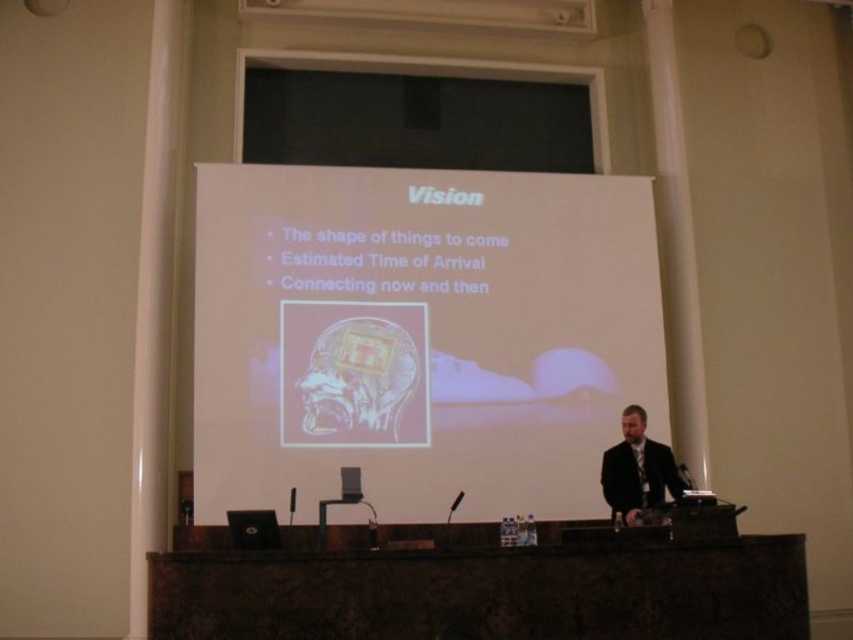
Question: Among these objects, which one is farthest from the camera?

Choices:
 (A) black matte screen at upper center
 (B) brown marble table at center
 (C) black matte suit at right
 (D) white matte projection screen at center

Answer: (A)

Question: Estimate the real-world distances between objects in this image. Which object is closer to the white matte projection screen at center?

Choices:
 (A) black matte suit at right
 (B) brown marble table at center

Answer: (A)

Question: Is brown marble table at center further to camera compared to black matte suit at right?

Choices:
 (A) yes
 (B) no

Answer: (B)

Question: Observing the image, what is the correct spatial positioning of black matte screen at upper center in reference to black matte suit at right?

Choices:
 (A) right
 (B) left

Answer: (B)

Question: Which of the following is the farthest from the observer?

Choices:
 (A) [627, 504]
 (B) [354, 104]

Answer: (B)

Question: Is brown marble table at center further to the viewer compared to black matte suit at right?

Choices:
 (A) no
 (B) yes

Answer: (A)